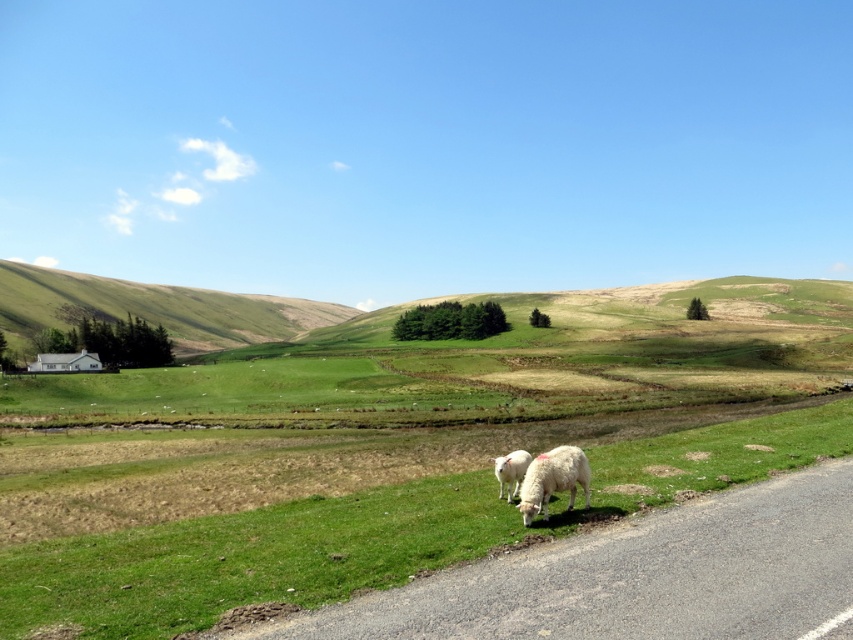
This screenshot has height=640, width=853. What do you see at coordinates (363, 532) in the screenshot?
I see `green grass at lower center` at bounding box center [363, 532].

Is green grass at lower center positioned before white woolly sheep at lower right?

Yes.

Where is `green grass at lower center`? This screenshot has height=640, width=853. green grass at lower center is located at coordinates (363, 532).

The height and width of the screenshot is (640, 853). I want to click on green grass at lower center, so click(363, 532).

This screenshot has height=640, width=853. Describe the element at coordinates (363, 532) in the screenshot. I see `green grass at lower center` at that location.

Which is below, green grass at lower center or white woolly sheep at lower center?

green grass at lower center is lower down.

Is point (136, 592) farther from camera compared to point (512, 480)?

That is False.

Find the location of a particular element. green grass at lower center is located at coordinates (363, 532).

Locate an element on the screen. green grassy hillside at left is located at coordinates (x=158, y=308).

Does point (126, 292) come closer to viewer compared to point (508, 454)?

No.

Measure the distance between green grassy hillside at left and camera.

green grassy hillside at left is 442.62 feet from camera.

At what (x,y) coordinates should I click in order to perform the action: click on green grassy hillside at left. Please return your answer as a coordinate pair (x, y). This screenshot has width=853, height=640. Looking at the image, I should click on [x=158, y=308].